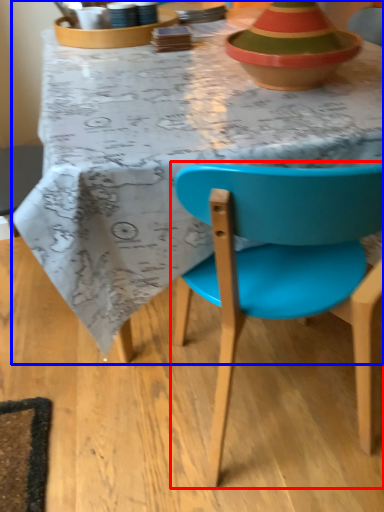
Question: Which of the following is the farthest to the observer, chair (highlighted by a red box) or desk (highlighted by a blue box)?

Choices:
 (A) chair
 (B) desk

Answer: (B)